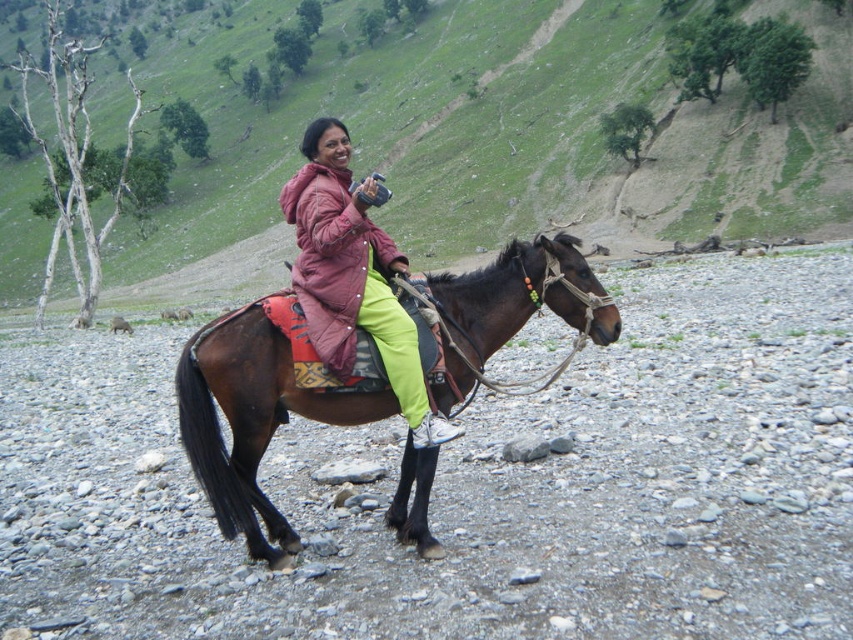
Is point (471, 58) positioned before point (363, 259)?

No, (471, 58) is behind (363, 259).

Can you confirm if brown horse at center is shorter than matte pink jacket at center?

Incorrect, brown horse at center's height does not fall short of matte pink jacket at center's.

Is point (460, 45) behind point (386, 312)?

Yes, point (460, 45) is behind point (386, 312).

Identify the location of brown horse at center. This screenshot has height=640, width=853. (509, 144).

Based on the photo, between brown glossy horse at center and matte pink jacket at center, which one appears on the right side from the viewer's perspective?

From the viewer's perspective, matte pink jacket at center appears more on the right side.

How far apart are brown glossy horse at center and matte pink jacket at center?

brown glossy horse at center is 1.51 meters away from matte pink jacket at center.

Which is behind, point (286, 332) or point (428, 440)?

Point (428, 440)

Where is `brown glossy horse at center`? The height and width of the screenshot is (640, 853). brown glossy horse at center is located at coordinates 253,417.

Who is positioned more to the left, brown horse at center or brown glossy horse at center?

brown horse at center is more to the left.

Does brown horse at center come in front of brown glossy horse at center?

No, it is behind brown glossy horse at center.

Find the location of a particular element. Image resolution: width=853 pixels, height=640 pixels. brown horse at center is located at coordinates (509, 144).